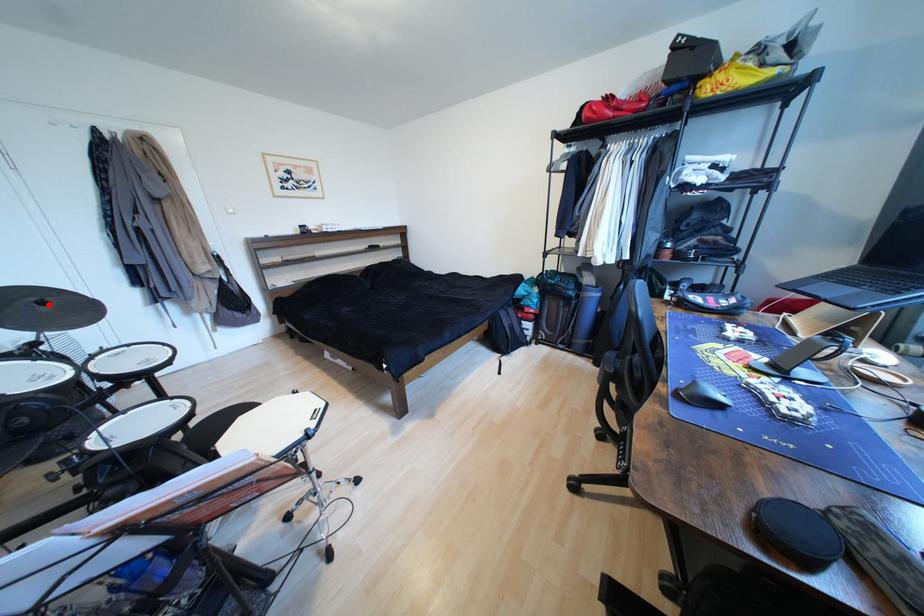
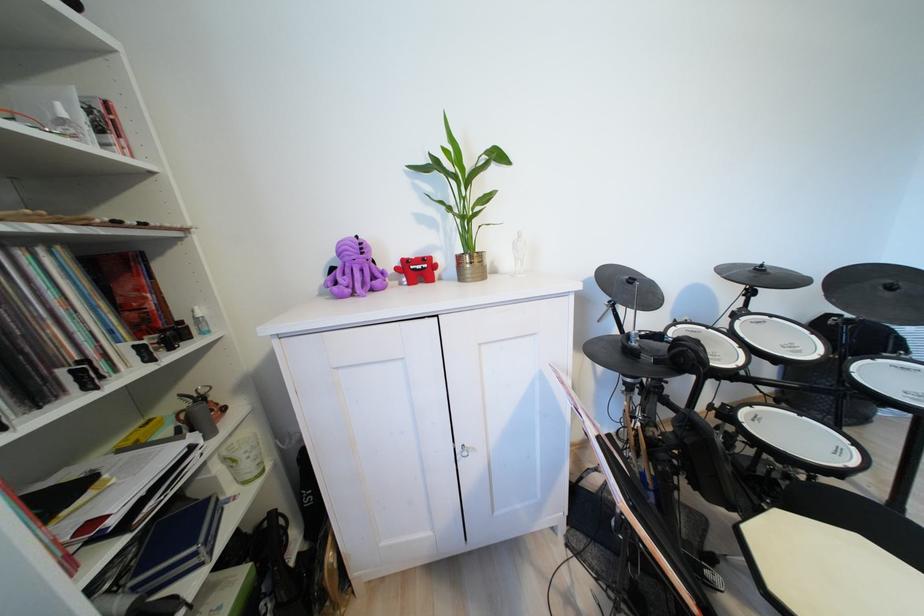
Question: I am providing you with two images of the same scene from different viewpoints. Image1 has a red point marked. In image2, the corresponding 3D location appears at what relative position? Reply with the corresponding letter.

Choices:
 (A) Closer
 (B) Farther

Answer: (A)